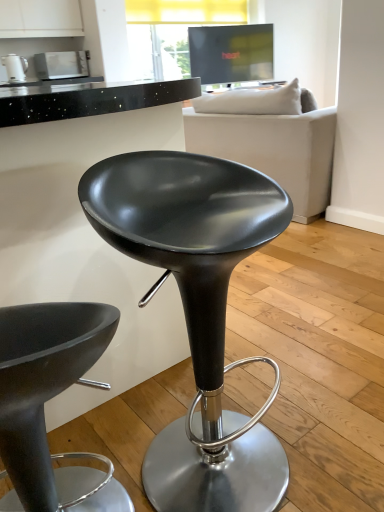
Question: From a real-world perspective, is matte white kettle at upper left, which ranks as the 2th appliance in right-to-left order, beneath matte white microwave at upper left, the second appliance when ordered from left to right?

Choices:
 (A) yes
 (B) no

Answer: (B)

Question: From a real-world perspective, is matte white kettle at upper left, marked as the first appliance in a left-to-right arrangement, over matte white microwave at upper left, which is the second appliance in front-to-back order?

Choices:
 (A) yes
 (B) no

Answer: (A)

Question: Is matte white kettle at upper left, positioned as the 1th appliance in front-to-back order, oriented towards matte white microwave at upper left, the first appliance viewed from the back?

Choices:
 (A) yes
 (B) no

Answer: (B)

Question: Is matte white kettle at upper left, acting as the second appliance starting from the back, not inside matte white microwave at upper left, the second appliance when ordered from left to right?

Choices:
 (A) no
 (B) yes

Answer: (B)

Question: Is matte white kettle at upper left, which ranks as the 2th appliance in right-to-left order, not near matte white microwave at upper left, which ranks as the 1th appliance in right-to-left order?

Choices:
 (A) yes
 (B) no

Answer: (B)

Question: Considering the relative positions of matte white kettle at upper left, positioned as the 1th appliance in front-to-back order, and matte white microwave at upper left, the first appliance viewed from the back, in the image provided, is matte white kettle at upper left, positioned as the 1th appliance in front-to-back order, in front of matte white microwave at upper left, the first appliance viewed from the back,?

Choices:
 (A) no
 (B) yes

Answer: (B)

Question: Can you confirm if matte black stool at center, the second chair in the left-to-right sequence, is smaller than matte white kettle at upper left, acting as the second appliance starting from the back?

Choices:
 (A) yes
 (B) no

Answer: (B)

Question: Is matte black stool at center, placed as the 1th chair when sorted from right to left, touching matte white kettle at upper left, marked as the first appliance in a left-to-right arrangement?

Choices:
 (A) no
 (B) yes

Answer: (A)

Question: Can you confirm if matte black stool at center, the second chair in the left-to-right sequence, is positioned to the right of matte white kettle at upper left, acting as the second appliance starting from the back?

Choices:
 (A) no
 (B) yes

Answer: (B)

Question: Does matte black stool at center, placed as the 1th chair when sorted from right to left, have a larger size compared to matte white kettle at upper left, acting as the second appliance starting from the back?

Choices:
 (A) yes
 (B) no

Answer: (A)

Question: Does matte black stool at center, the second chair in the left-to-right sequence, lie behind matte white kettle at upper left, acting as the second appliance starting from the back?

Choices:
 (A) yes
 (B) no

Answer: (B)

Question: From the image's perspective, is matte black stool at center, placed as the 1th chair when sorted from right to left, over matte white kettle at upper left, marked as the first appliance in a left-to-right arrangement?

Choices:
 (A) yes
 (B) no

Answer: (B)

Question: Is white fabric couch at upper center far from matte white kettle at upper left, which ranks as the 2th appliance in right-to-left order?

Choices:
 (A) no
 (B) yes

Answer: (B)